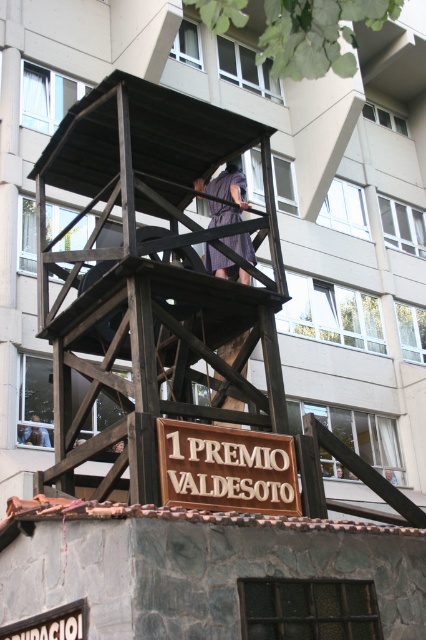
You are a visitor at this wooden watchtower and want to take a photo of both the dark purple dress at center and the dark brown wooden figure at center. Which object should you focus on first to ensure both are in frame?

The dark purple dress at center is much taller than the dark brown wooden figure at center, so you should focus on the dark purple dress at center first to ensure both are in frame.

You are an architect designing a new observation deck. You need to place both the wooden scaffolding at center and the dark brown wooden figure at center on the deck. Which object should you place first to ensure there is enough space for both?

You should place the wooden scaffolding at center first because it is wider than the dark brown wooden figure at center, ensuring there is enough space for both.

You are an architect designing a new observation deck and want to ensure safety for visitors. Given the wooden scaffolding at center and the dark brown wooden figure at center in the scene, which object would you prioritize reinforcing to prevent structural issues, and why?

The wooden scaffolding at center should be prioritized for reinforcement because it is larger in size than the dark brown wooden figure at center, making it more critical to the overall structural integrity of the observation platform.